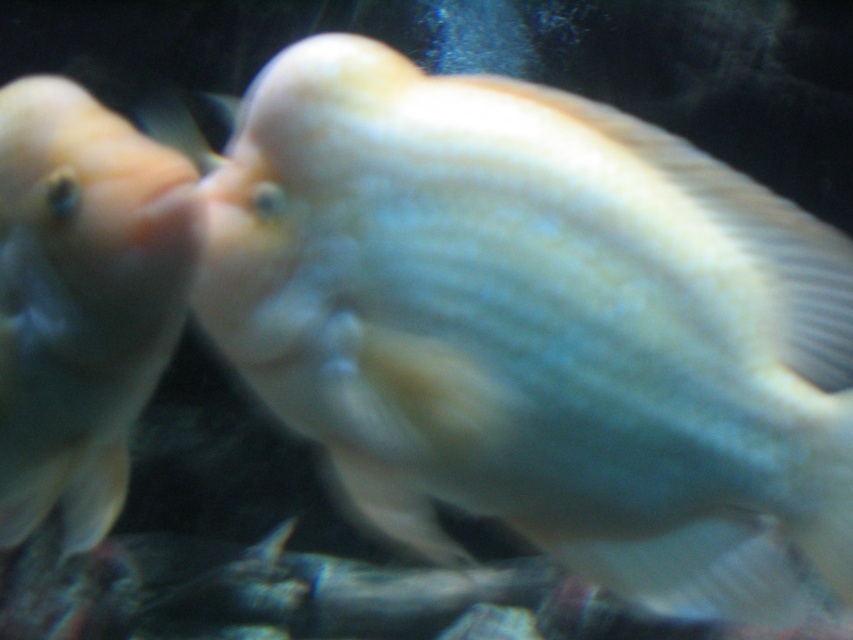
You are an aquarium caretaker trying to determine the space each fish occupies. Based on the image, which fish has a greater width between the smooth white fish at center and the matte white fish at left?

The smooth white fish at center might be wider than matte white fish at left according to the description.

You are an aquarium caretaker observing two fish in the tank. You notice the smooth white fish at center and the matte white fish at left. From your perspective, which fish is closer to you?

The smooth white fish at center is closer to you because it is in front of the matte white fish at left.